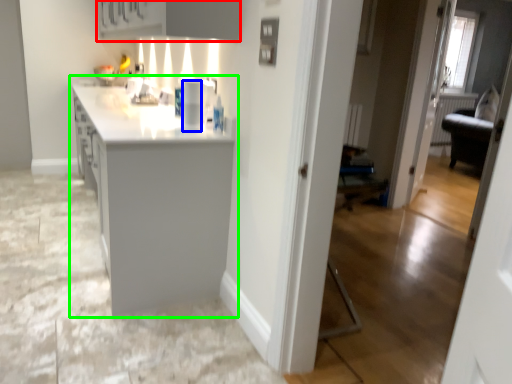
Question: Considering the real-world distances, which object is farthest from cabinetry (highlighted by a red box)? appliance (highlighted by a blue box) or countertop (highlighted by a green box)?

Choices:
 (A) appliance
 (B) countertop

Answer: (B)